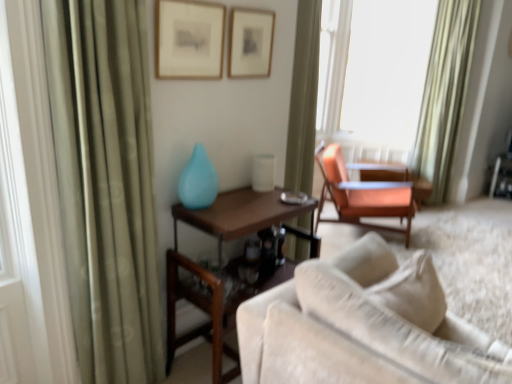
Question: Is wooden table at center, the first table in the left-to-right sequence, positioned behind matte orange table at right, the second table positioned from the front?

Choices:
 (A) no
 (B) yes

Answer: (A)

Question: From a real-world perspective, is wooden table at center, which is the 1th table in front-to-back order, below matte orange table at right, the first table viewed from the right?

Choices:
 (A) yes
 (B) no

Answer: (B)

Question: Is wooden table at center, which is the 1th table in front-to-back order, thinner than matte orange table at right, the second table positioned from the front?

Choices:
 (A) yes
 (B) no

Answer: (B)

Question: Would you say matte orange table at right, the 1th table positioned from the back, is part of wooden table at center, arranged as the second table when viewed from the back,'s contents?

Choices:
 (A) yes
 (B) no

Answer: (B)

Question: Is wooden table at center, which is the 1th table in front-to-back order, not inside matte orange table at right, the second table positioned from the front?

Choices:
 (A) yes
 (B) no

Answer: (A)

Question: In the image, is green fabric curtain at left, which is the 2th curtain in right-to-left order, positioned in front of or behind matte orange table at right, the second table positioned from the front?

Choices:
 (A) front
 (B) behind

Answer: (A)

Question: In terms of height, does green fabric curtain at left, which ranks as the first curtain in front-to-back order, look taller or shorter compared to matte orange table at right, the first table viewed from the right?

Choices:
 (A) tall
 (B) short

Answer: (A)

Question: Is point (125, 145) positioned closer to the camera than point (419, 200)?

Choices:
 (A) farther
 (B) closer

Answer: (B)

Question: In terms of size, does green fabric curtain at left, which is the 2th curtain in right-to-left order, appear bigger or smaller than matte orange table at right, the second table positioned from the front?

Choices:
 (A) big
 (B) small

Answer: (A)

Question: Is point (243, 360) closer or farther from the camera than point (451, 76)?

Choices:
 (A) closer
 (B) farther

Answer: (A)

Question: Is beige fabric couch at lower right spatially inside green satin curtain at upper right, the 2th curtain in the front-to-back sequence, or outside of it?

Choices:
 (A) outside
 (B) inside

Answer: (A)

Question: Is beige fabric couch at lower right bigger or smaller than green satin curtain at upper right, the 2th curtain in the front-to-back sequence?

Choices:
 (A) big
 (B) small

Answer: (A)

Question: Considering the positions of beige fabric couch at lower right and green satin curtain at upper right, the 2th curtain in the left-to-right sequence, in the image, is beige fabric couch at lower right taller or shorter than green satin curtain at upper right, the 2th curtain in the left-to-right sequence,?

Choices:
 (A) short
 (B) tall

Answer: (A)

Question: In the image, is green fabric curtain at left, which ranks as the first curtain in front-to-back order, positioned in front of or behind green satin curtain at upper right, the 2th curtain in the front-to-back sequence?

Choices:
 (A) front
 (B) behind

Answer: (A)

Question: From the image's perspective, is green fabric curtain at left, which is the 2th curtain in right-to-left order, positioned above or below green satin curtain at upper right, the 2th curtain in the left-to-right sequence?

Choices:
 (A) below
 (B) above

Answer: (A)